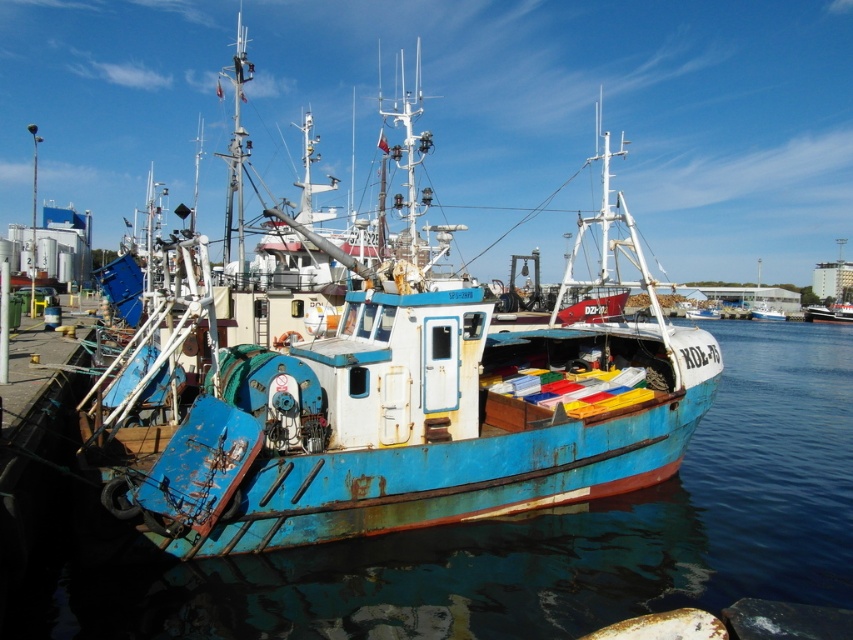
The image size is (853, 640). What do you see at coordinates (387, 413) in the screenshot? I see `rusty metal boat at center` at bounding box center [387, 413].

Does rusty metal boat at center have a smaller size compared to blue metallic water at center?

No.

The height and width of the screenshot is (640, 853). I want to click on rusty metal boat at center, so click(387, 413).

Locate an element on the screen. rusty metal boat at center is located at coordinates (387, 413).